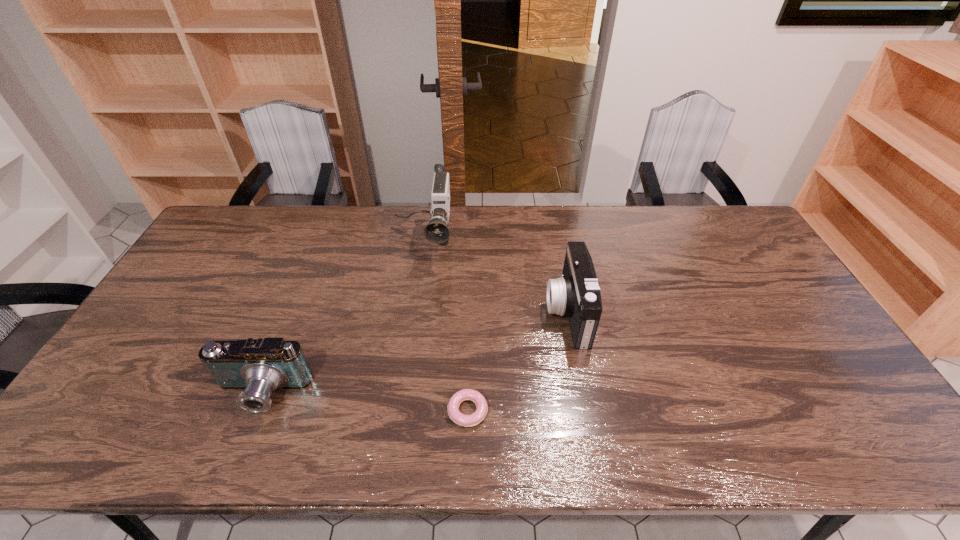
You are a GUI agent. You are given a task and a screenshot of the screen. Output one action in this format:
    pyautogui.click(x=<x>, y=<y>)
    Task: Click on the free space between the nearest camcorder and the second camcorder from right to left
    This screenshot has height=540, width=960.
    Given the screenshot: What is the action you would take?
    pyautogui.click(x=343, y=318)

Identify the location of free space between the shortest object and the leftmost camcorder. point(364,402).

Where is `free spot between the third tallest object and the farthest object`? This screenshot has height=540, width=960. free spot between the third tallest object and the farthest object is located at coordinates (343, 318).

At what (x,y) coordinates should I click in order to perform the action: click on free space between the third object from left to right and the leftmost object. Please return your answer as a coordinate pair (x, y). This screenshot has height=540, width=960. Looking at the image, I should click on (364, 402).

Where is `vacant space in between the leftmost object and the shortest object`? The width and height of the screenshot is (960, 540). vacant space in between the leftmost object and the shortest object is located at coordinates (364, 402).

Locate an element on the screen. free spot between the third object from left to right and the second object from left to right is located at coordinates (445, 327).

Where is `free point between the third object from left to right and the rightmost object`? The width and height of the screenshot is (960, 540). free point between the third object from left to right and the rightmost object is located at coordinates (517, 361).

The height and width of the screenshot is (540, 960). I want to click on unoccupied area between the farthest camcorder and the leftmost camcorder, so click(343, 318).

At what (x,y) coordinates should I click in order to perform the action: click on free space between the third shortest object and the tallest camcorder. Please return your answer as a coordinate pair (x, y). Looking at the image, I should click on (495, 277).

The image size is (960, 540). I want to click on vacant area between the nearest camcorder and the farthest object, so click(x=343, y=318).